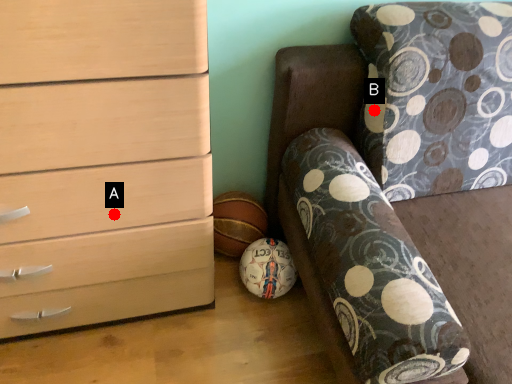
Question: Two points are circled on the image, labeled by A and B beside each circle. Which of the following is the farthest from the observer?

Choices:
 (A) A is further
 (B) B is further

Answer: (B)